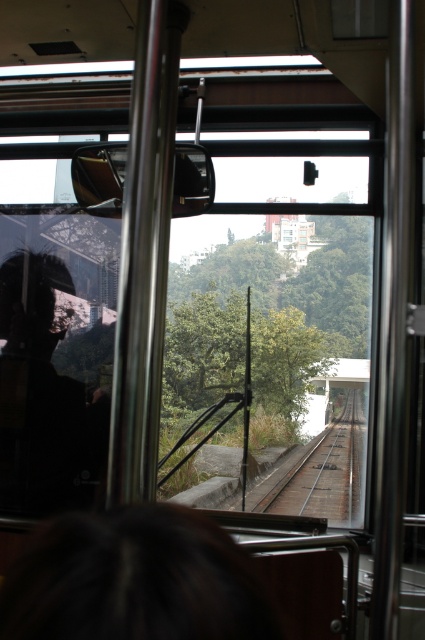
You are a passenger in the cable car and want to know if you can safely reach the brown wooden train track at center from your current position near the dark brown hair at lower center without moving your seat. The minimum safe distance required is 10 feet. Is the distance sufficient?

The dark brown hair at lower center and brown wooden train track at center are 10.67 feet apart from each other. Since the minimum safe distance required is 10 feet, the distance of 10.67 feet is sufficient for safe reaching.

In the scene shown: You are inside the cable car and want to know which object, the silhouette glass at left or the brown wooden train track at center, is closer to you. Based on their heights in the view, can you determine which one is nearer?

The silhouette glass at left is taller than the brown wooden train track at center in the view, so the silhouette glass at left is closer to you because objects closer appear larger in size.